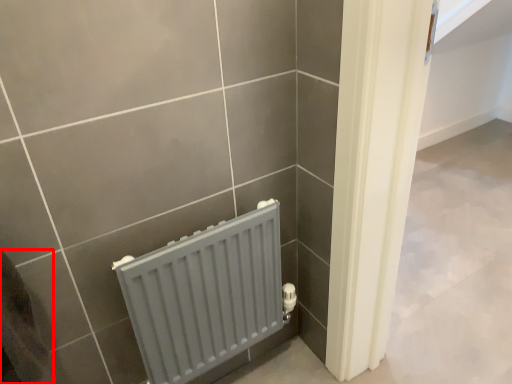
Question: Observing the image, what is the correct spatial positioning of gray (annotated by the red box) in reference to radiator?

Choices:
 (A) right
 (B) left

Answer: (B)